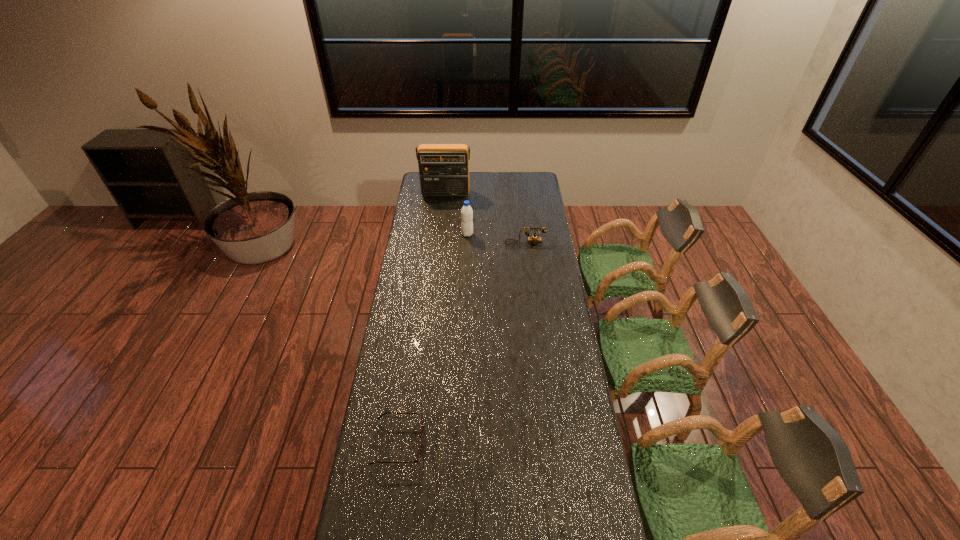
This screenshot has width=960, height=540. In order to click on vacant area in the image that satisfies the following two spatial constraints: 1. on the front-facing side of the radio receiver; 2. on the lenses of the spectacles in this screenshot , I will do `click(420, 443)`.